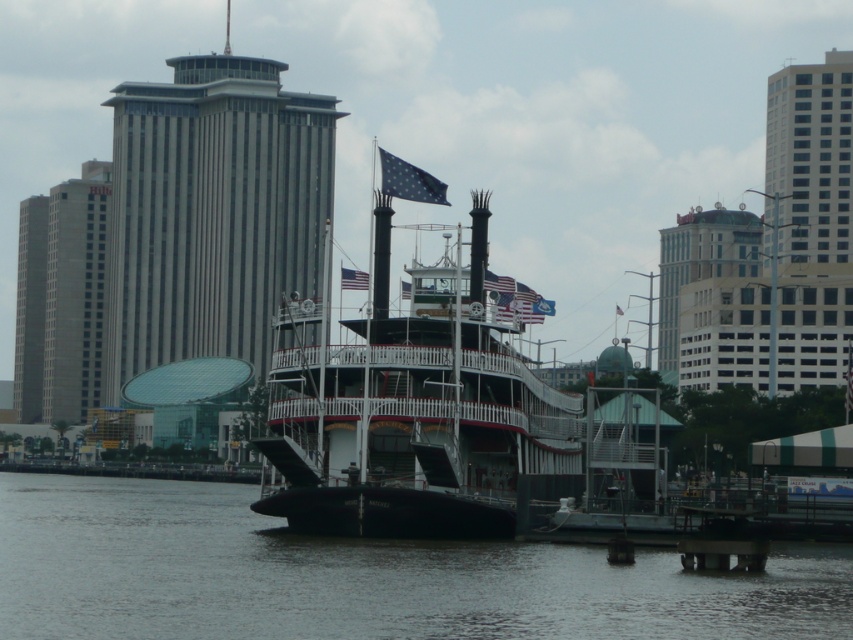
Does point (666, 328) lie in front of point (695, 561)?

No.

Does green glass building at upper center have a lesser height compared to smooth concrete dock at lower center?

No, green glass building at upper center is not shorter than smooth concrete dock at lower center.

Identify the location of green glass building at upper center. The image size is (853, 640). pyautogui.click(x=701, y=262).

Is point (38, 324) farther from viewer compared to point (403, 168)?

Yes, point (38, 324) is behind point (403, 168).

Is the position of gray concrete building at left less distant than that of blue fabric flag at center?

No, gray concrete building at left is behind blue fabric flag at center.

Who is more distant from viewer, (41, 412) or (405, 172)?

Point (41, 412)

This screenshot has height=640, width=853. Find the location of `gray concrete building at left`. gray concrete building at left is located at coordinates pyautogui.click(x=62, y=298).

Which of these two, gray glass skyscraper at center or gray glass skyscraper at left, stands taller?

gray glass skyscraper at center is taller.

Locate an element on the screen. This screenshot has width=853, height=640. gray glass skyscraper at center is located at coordinates (212, 211).